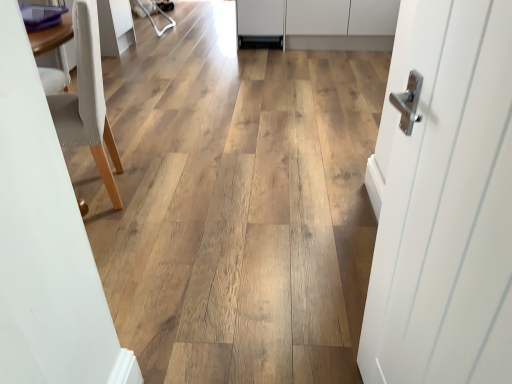
Question: Can you confirm if white smooth door at right is thinner than light beige fabric chair at left?

Choices:
 (A) no
 (B) yes

Answer: (B)

Question: Is white smooth door at right placed right next to light beige fabric chair at left?

Choices:
 (A) yes
 (B) no

Answer: (B)

Question: Does white smooth door at right come behind light beige fabric chair at left?

Choices:
 (A) yes
 (B) no

Answer: (B)

Question: Is white smooth door at right looking in the opposite direction of light beige fabric chair at left?

Choices:
 (A) yes
 (B) no

Answer: (B)

Question: Does white smooth door at right appear on the left side of light beige fabric chair at left?

Choices:
 (A) yes
 (B) no

Answer: (B)

Question: Is white smooth door at right bigger than light beige fabric chair at left?

Choices:
 (A) yes
 (B) no

Answer: (B)

Question: Is light beige fabric chair at left not inside white matte cabinet at upper center?

Choices:
 (A) yes
 (B) no

Answer: (A)

Question: Is light beige fabric chair at left oriented towards white matte cabinet at upper center?

Choices:
 (A) no
 (B) yes

Answer: (A)

Question: Can you confirm if light beige fabric chair at left is positioned to the left of white matte cabinet at upper center?

Choices:
 (A) no
 (B) yes

Answer: (B)

Question: Is white matte cabinet at upper center inside light beige fabric chair at left?

Choices:
 (A) no
 (B) yes

Answer: (A)

Question: Does light beige fabric chair at left have a greater height compared to white matte cabinet at upper center?

Choices:
 (A) yes
 (B) no

Answer: (A)

Question: Are light beige fabric chair at left and white matte cabinet at upper center making contact?

Choices:
 (A) no
 (B) yes

Answer: (A)

Question: From the image's perspective, does light beige fabric chair at left appear lower than white smooth door at right?

Choices:
 (A) yes
 (B) no

Answer: (B)